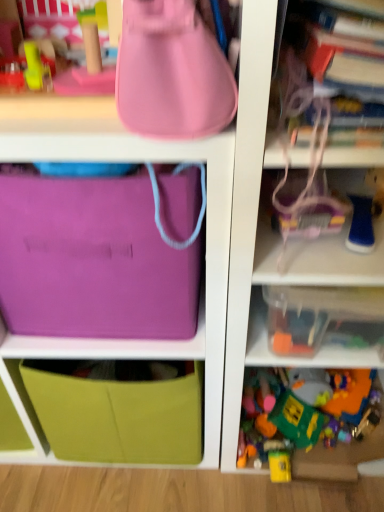
Question: Is matte pink handbag at upper center at the right side of matte purple pouch at center?

Choices:
 (A) yes
 (B) no

Answer: (A)

Question: From a real-world perspective, is matte pink handbag at upper center located higher than matte purple pouch at center?

Choices:
 (A) no
 (B) yes

Answer: (B)

Question: Is matte pink handbag at upper center facing towards matte purple pouch at center?

Choices:
 (A) no
 (B) yes

Answer: (A)

Question: Does matte pink handbag at upper center have a larger size compared to matte purple pouch at center?

Choices:
 (A) yes
 (B) no

Answer: (B)

Question: Is matte pink handbag at upper center positioned with its back to matte purple pouch at center?

Choices:
 (A) yes
 (B) no

Answer: (B)

Question: Considering the relative sizes of matte pink handbag at upper center and matte purple pouch at center in the image provided, is matte pink handbag at upper center taller than matte purple pouch at center?

Choices:
 (A) no
 (B) yes

Answer: (A)

Question: Does matte pink handbag at upper center have a greater width compared to purple fabric bag at upper left?

Choices:
 (A) yes
 (B) no

Answer: (B)

Question: Is matte pink handbag at upper center oriented towards purple fabric bag at upper left?

Choices:
 (A) no
 (B) yes

Answer: (A)

Question: Could purple fabric bag at upper left be considered to be inside matte pink handbag at upper center?

Choices:
 (A) yes
 (B) no

Answer: (B)

Question: Considering the relative sizes of matte pink handbag at upper center and purple fabric bag at upper left in the image provided, is matte pink handbag at upper center taller than purple fabric bag at upper left?

Choices:
 (A) yes
 (B) no

Answer: (B)

Question: Does matte pink handbag at upper center appear on the left side of purple fabric bag at upper left?

Choices:
 (A) no
 (B) yes

Answer: (A)

Question: From the image's perspective, is matte pink handbag at upper center located above purple fabric bag at upper left?

Choices:
 (A) no
 (B) yes

Answer: (B)

Question: Does matte pink handbag at upper center have a larger size compared to translucent plastic container at lower right, marked as the 1th toy in a back-to-front arrangement?

Choices:
 (A) yes
 (B) no

Answer: (B)